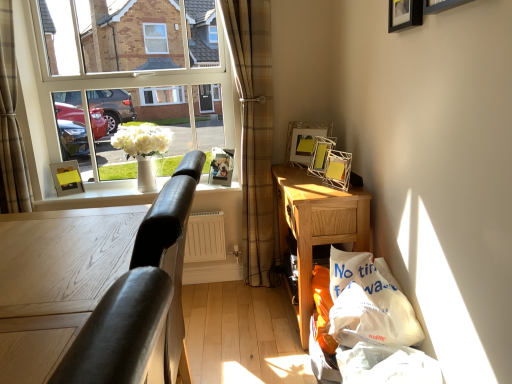
At what (x,y) coordinates should I click in order to perform the action: click on blank space to the left of brown plaid curtain at left, marked as the 2th curtain in a left-to-right arrangement. Please return your answer as a coordinate pair (x, y). Looking at the image, I should click on (214, 298).